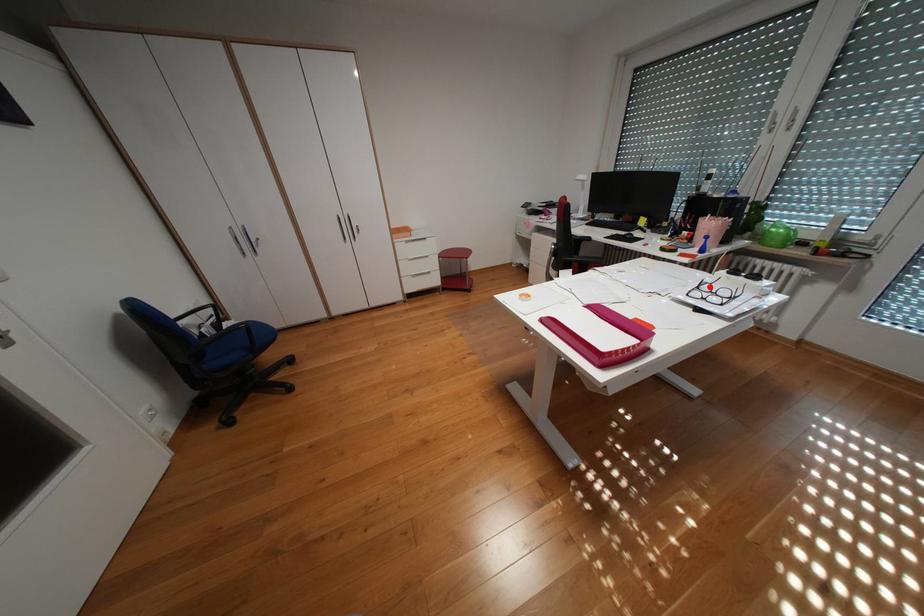
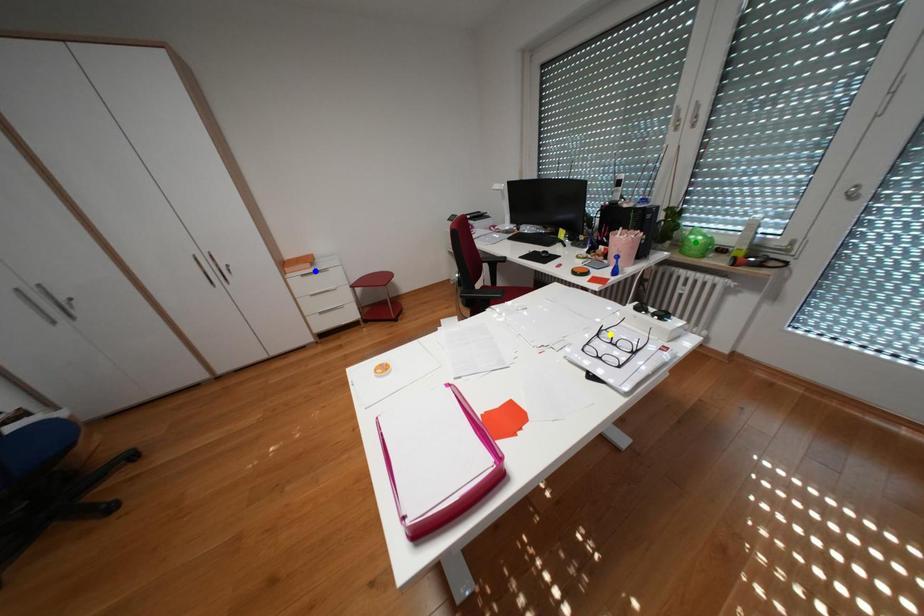
Question: I am providing you with two images of the same scene from different viewpoints. A red point is marked on the first image. You are given multiple points on the second image. Can you choose the point in image 2 that corresponds to the point in image 1?

Choices:
 (A) blue point
 (B) green point
 (C) yellow point

Answer: (C)